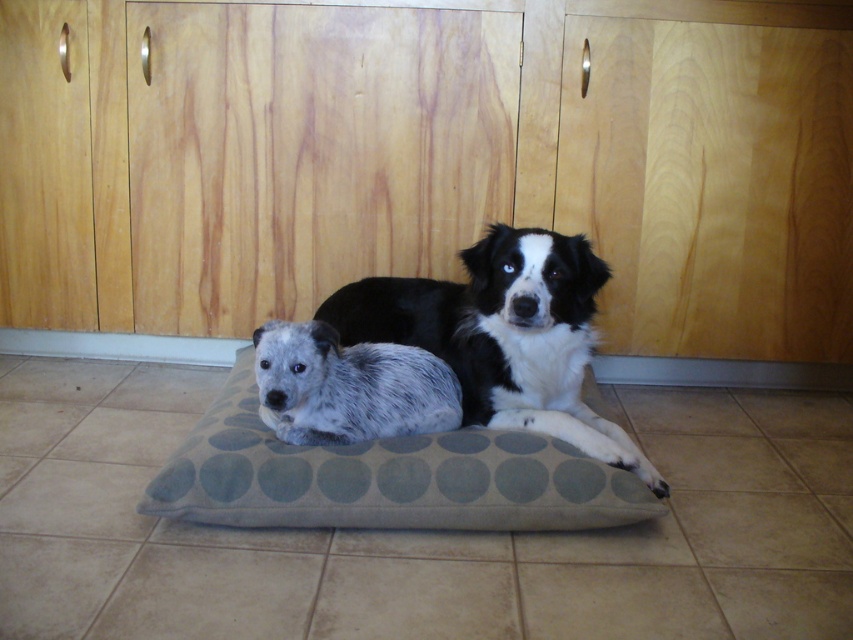
You are a photographer setting up a camera at position 0.5, 0.5. You want to focus on the black and white fur dog at center. Is the dog closer to the camera or further away based on its 2D coordinates?

The black and white fur dog at center is located at 2D coordinates (x=503, y=336) which is slightly to the right and above the camera position at (x=426, y=320). However, 2D coordinates alone cannot determine depth, so we cannot conclude if it is closer or further away.

You are a dog owner who wants to take a photo of your two dogs. You notice the gray dotted fabric dog bed at center and the spotted fur dog at center. Which object is closer to the camera?

The gray dotted fabric dog bed at center is closer to the camera than the spotted fur dog at center because it is in front of it.